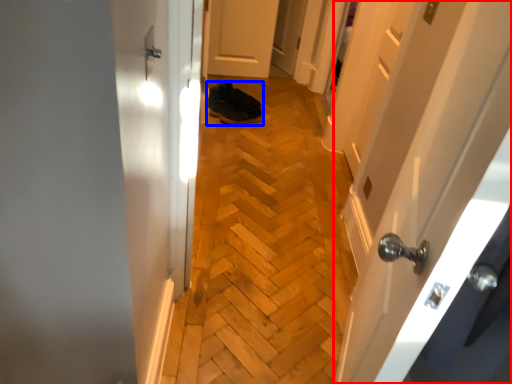
Question: Among these objects, which one is nearest to the camera, door (highlighted by a red box) or footwear (highlighted by a blue box)?

Choices:
 (A) door
 (B) footwear

Answer: (A)